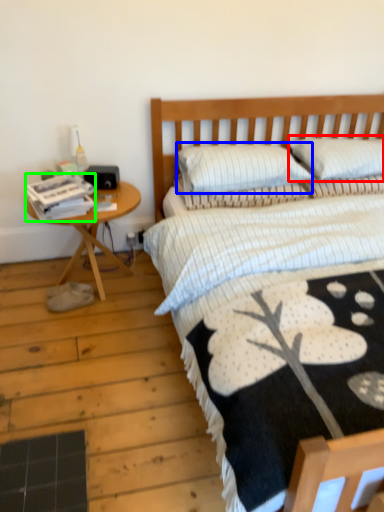
Question: Which object is the closest to the pillow (highlighted by a red box)? Choose among these: pillow (highlighted by a blue box) or magazine (highlighted by a green box).

Choices:
 (A) pillow
 (B) magazine

Answer: (A)